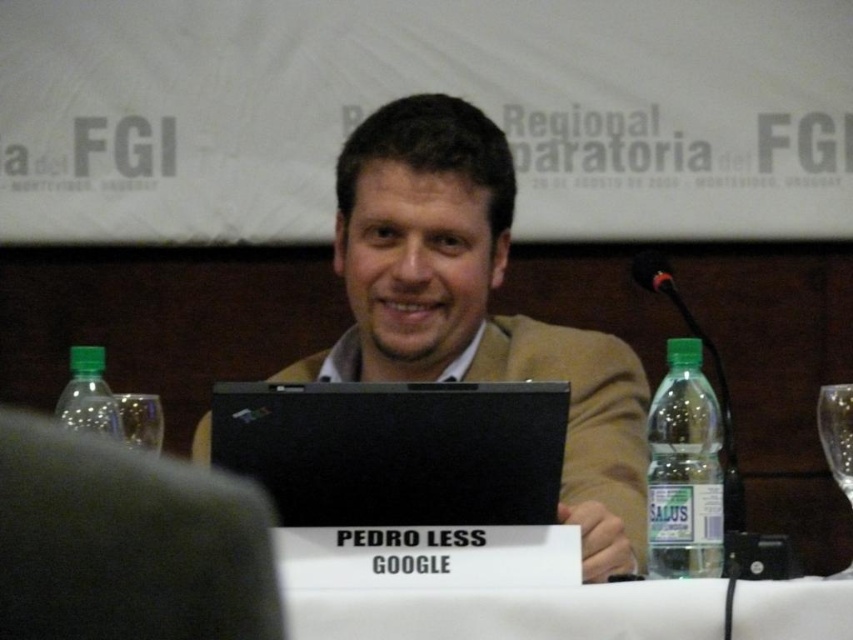
Can you confirm if matte black laptop at center is smaller than green plastic bottle at left?

No, matte black laptop at center is not smaller than green plastic bottle at left.

Which is more to the right, matte black laptop at center or green plastic bottle at left?

matte black laptop at center is more to the right.

Between point (392, 355) and point (79, 387), which one is positioned behind?

Point (392, 355)

The image size is (853, 640). What are the coordinates of `matte black laptop at center` in the screenshot? It's located at click(474, 307).

Between point (641, 371) and point (138, 538), which one is positioned behind?

Positioned behind is point (641, 371).

Does matte black laptop at center appear under gray fabric at lower left?

Yes, matte black laptop at center is below gray fabric at lower left.

Does point (376, 150) come in front of point (33, 442)?

No, it is not.

What are the coordinates of `matte black laptop at center` in the screenshot? It's located at (474, 307).

Does clear plastic bottle at right appear on the right side of green plastic bottle at left?

Correct, you'll find clear plastic bottle at right to the right of green plastic bottle at left.

Between clear plastic bottle at right and green plastic bottle at left, which one appears on the left side from the viewer's perspective?

Positioned to the left is green plastic bottle at left.

Between point (705, 449) and point (102, 362), which one is positioned in front?

Positioned in front is point (705, 449).

Where is `clear plastic bottle at right`? This screenshot has width=853, height=640. clear plastic bottle at right is located at coordinates (683, 468).